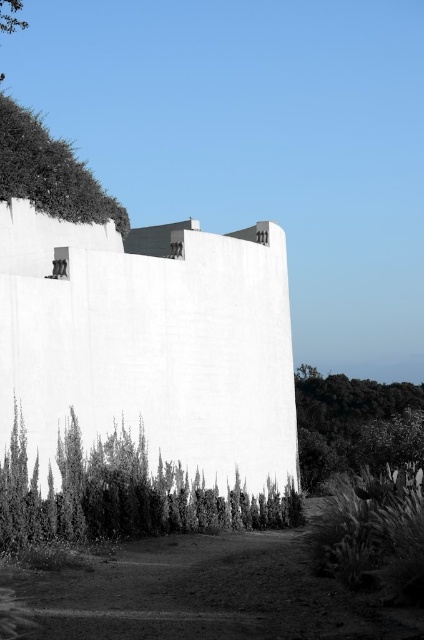
Question: Which point is farther to the camera?

Choices:
 (A) (2, 13)
 (B) (60, 524)
 (C) (393, 460)

Answer: (A)

Question: Does green leafy shrub at lower left appear on the right side of green leafy tree at lower right?

Choices:
 (A) no
 (B) yes

Answer: (A)

Question: Which point is closer to the camera?

Choices:
 (A) (326, 388)
 (B) (186, 492)

Answer: (B)

Question: Among these points, which one is farthest from the camera?

Choices:
 (A) (5, 16)
 (B) (45, 515)

Answer: (A)

Question: In this image, where is green leafy shrub at lower left located relative to green leafy tree at lower right?

Choices:
 (A) left
 (B) right

Answer: (A)

Question: Considering the relative positions of green leafy shrub at lower left and green leafy tree at upper left in the image provided, where is green leafy shrub at lower left located with respect to green leafy tree at upper left?

Choices:
 (A) above
 (B) below

Answer: (B)